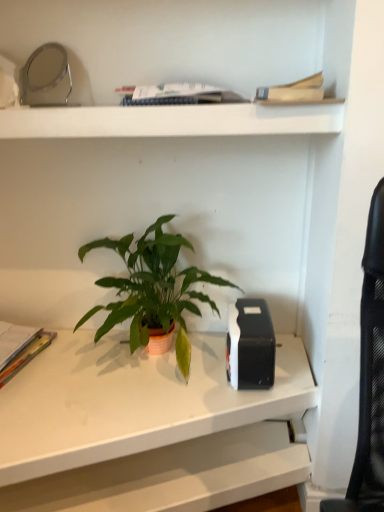
What are the coordinates of `free location to the right of multicolored paper at left, the second paperback book viewed from the right` in the screenshot? It's located at (67, 368).